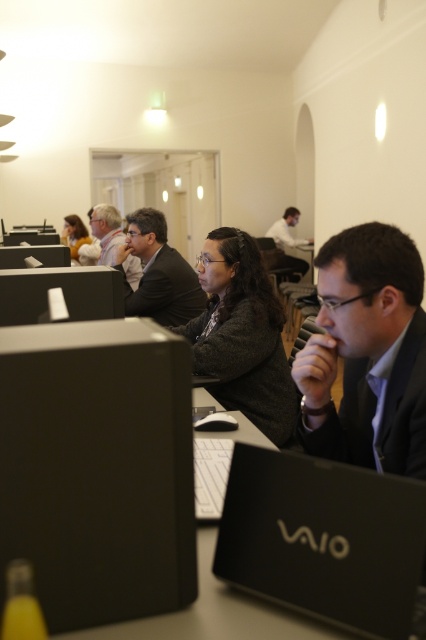
Question: Which of the following is the farthest from the observer?

Choices:
 (A) (63, 234)
 (B) (255, 456)
 (C) (74, 522)

Answer: (A)

Question: From the image, what is the correct spatial relationship of dark gray suit at center in relation to matte black suit at center?

Choices:
 (A) above
 (B) below

Answer: (B)

Question: Among these objects, which one is farthest from the camera?

Choices:
 (A) dark gray suit at center
 (B) black plastic computer at center
 (C) black matte laptop at center
 (D) matte gray suit at center

Answer: (D)

Question: Which of the following is the farthest from the observer?

Choices:
 (A) (169, 291)
 (B) (77, 230)
 (C) (376, 532)

Answer: (B)

Question: In this image, where is dark gray suit at center located relative to matte gray suit at center?

Choices:
 (A) above
 (B) below

Answer: (B)

Question: Does matte black suit at center appear under matte yellow shirt at left?

Choices:
 (A) no
 (B) yes

Answer: (A)